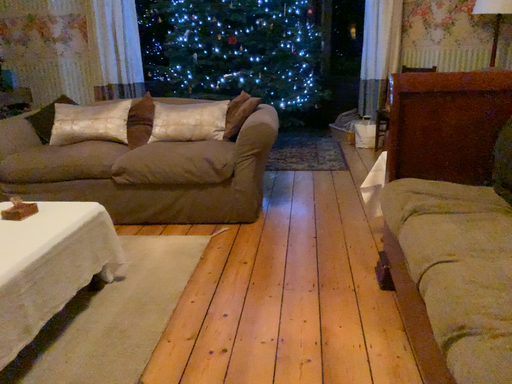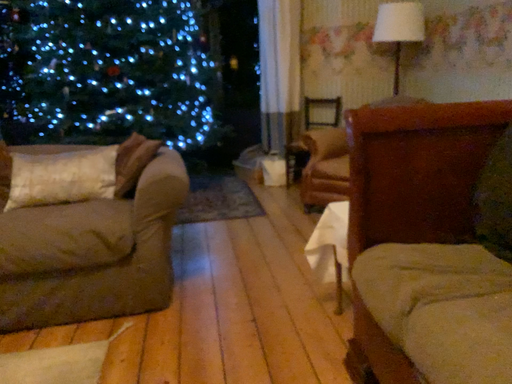
Question: How did the camera likely rotate when shooting the video?

Choices:
 (A) rotated right
 (B) rotated left

Answer: (A)